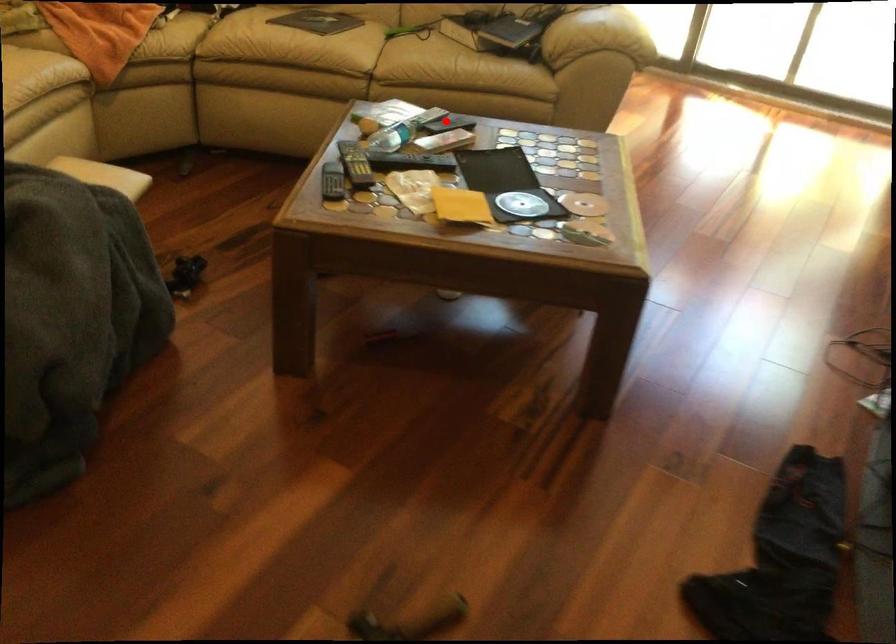
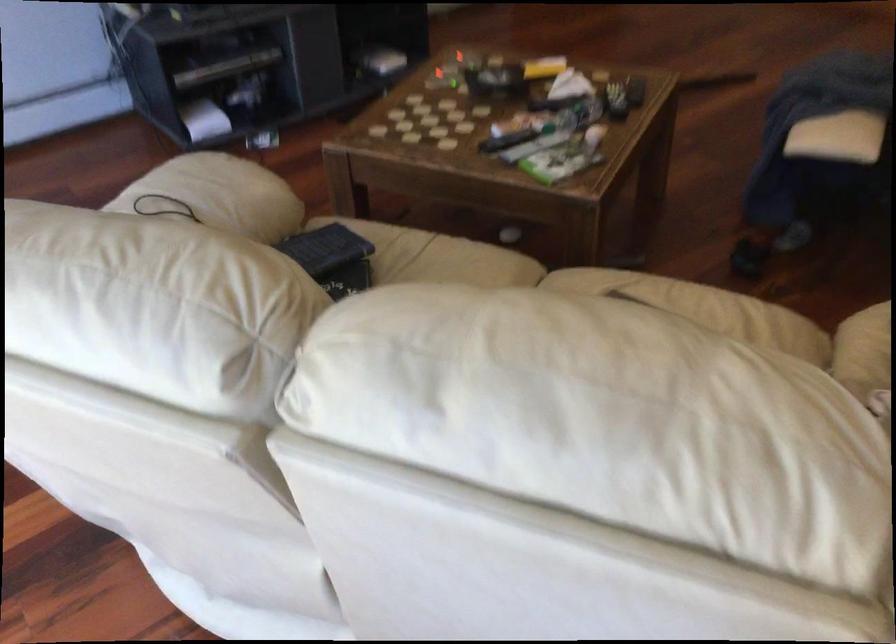
Question: I am providing you with two images of the same scene from different viewpoints. A red point is marked on the first image. Is the red point's position out of view in image 2?

Choices:
 (A) Yes
 (B) No

Answer: (B)